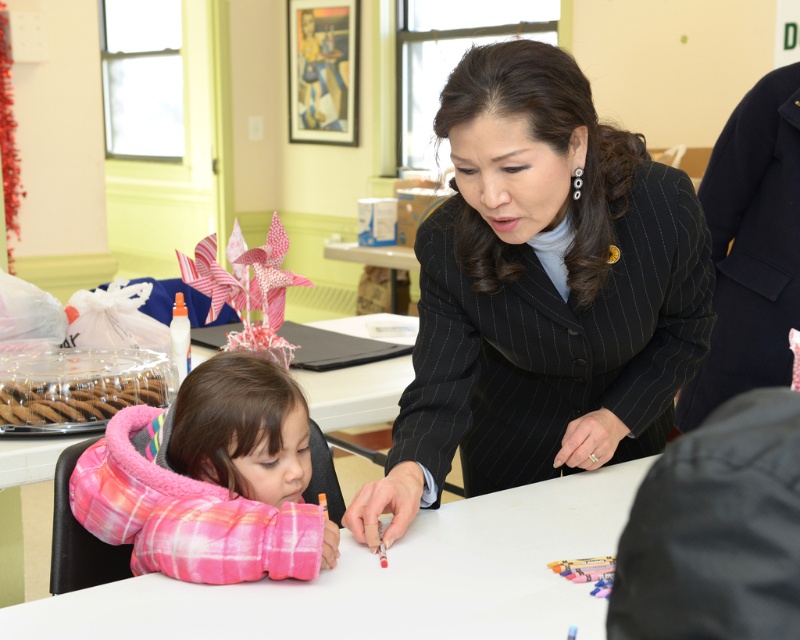
Based on the coordinates provided, what object is located at point (388, 579) in the image?

The point (388, 579) marks the location of the white glossy table at center.

You are a photographer setting up a camera to capture the scene. You need to ensure that both the black pinstripe suit at center and the black pinstripe suit at upper right are fully visible in the frame. Based on their positions, which one might require you to adjust the camera angle more to include it in the shot?

The black pinstripe suit at upper right might require more adjustment since it is positioned further away from the camera compared to the one at center, which is closer and might already be within the frame.